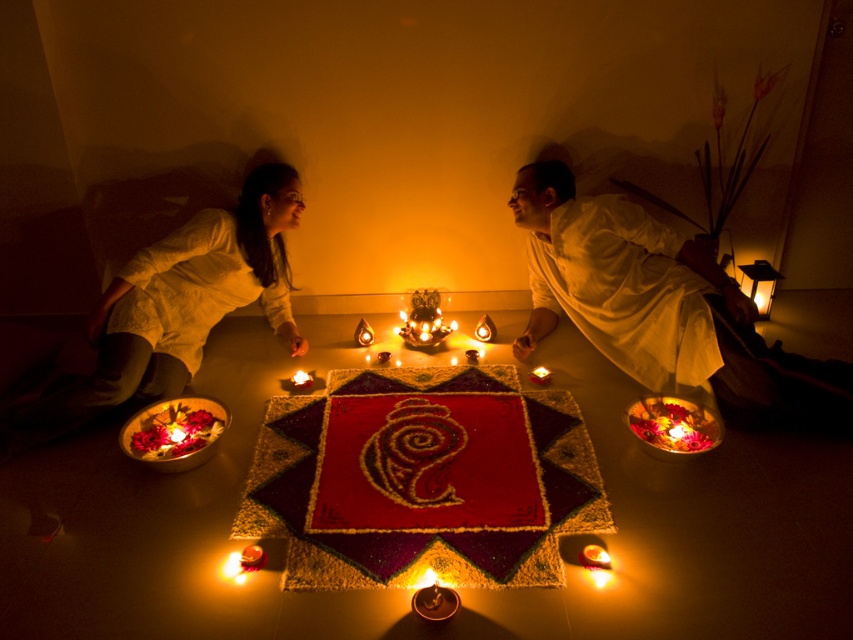
Is matte black lantern at upper right taller than matte glass candle at center?

Yes, matte black lantern at upper right is taller than matte glass candle at center.

Does matte black lantern at upper right have a smaller size compared to matte glass candle at center?

No, matte black lantern at upper right is not smaller than matte glass candle at center.

Who is more forward, (773, 289) or (300, 385)?

Positioned in front is point (300, 385).

Locate an element on the screen. The width and height of the screenshot is (853, 640). matte black lantern at upper right is located at coordinates (759, 284).

Does white cotton man at center appear over matte black lantern at upper right?

Incorrect, white cotton man at center is not positioned above matte black lantern at upper right.

Is white cotton man at center to the right of matte black lantern at upper right from the viewer's perspective?

Incorrect, white cotton man at center is not on the right side of matte black lantern at upper right.

Find the location of a particular element. The image size is (853, 640). white cotton man at center is located at coordinates (619, 282).

Is white cotton man at center taller than matte glass candle at center?

Indeed, white cotton man at center has a greater height compared to matte glass candle at center.

Does white cotton man at center appear over matte glass candle at center?

Correct, white cotton man at center is located above matte glass candle at center.

Is point (531, 348) in front of point (302, 376)?

That is False.

Find the location of `white cotton man at center`. white cotton man at center is located at coordinates (619, 282).